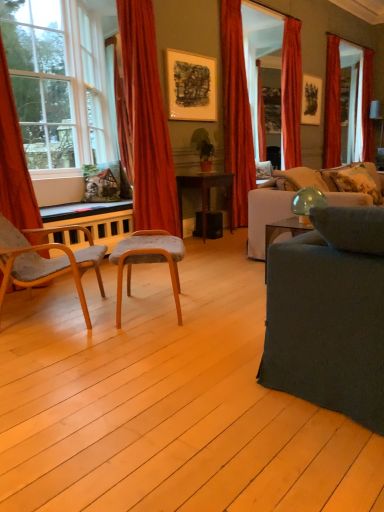
Question: Considering the relative sizes of beige fabric pillow at right, the first pillow when ordered from left to right, and red velvet curtain at upper right, marked as the first curtain in a back-to-front arrangement, in the image provided, is beige fabric pillow at right, the first pillow when ordered from left to right, bigger than red velvet curtain at upper right, marked as the first curtain in a back-to-front arrangement,?

Choices:
 (A) yes
 (B) no

Answer: (B)

Question: Considering the relative sizes of beige fabric pillow at right, the first pillow when ordered from left to right, and red velvet curtain at upper right, which is the 5th curtain in left-to-right order, in the image provided, is beige fabric pillow at right, the first pillow when ordered from left to right, taller than red velvet curtain at upper right, which is the 5th curtain in left-to-right order,?

Choices:
 (A) no
 (B) yes

Answer: (A)

Question: From a real-world perspective, is beige fabric pillow at right, acting as the 2th pillow starting from the right, over red velvet curtain at upper right, which is the 5th curtain in left-to-right order?

Choices:
 (A) no
 (B) yes

Answer: (A)

Question: From the image's perspective, does beige fabric pillow at right, acting as the 2th pillow starting from the right, appear higher than red velvet curtain at upper right, marked as the 5th curtain in a front-to-back arrangement?

Choices:
 (A) no
 (B) yes

Answer: (A)

Question: Is beige fabric pillow at right, the first pillow when ordered from left to right, facing towards red velvet curtain at upper right, which is the 5th curtain in left-to-right order?

Choices:
 (A) no
 (B) yes

Answer: (A)

Question: Is beige fabric pillow at right, acting as the 2th pillow starting from the right, to the left of red velvet curtain at upper right, marked as the first curtain in a back-to-front arrangement, from the viewer's perspective?

Choices:
 (A) yes
 (B) no

Answer: (A)

Question: Is velvet red curtain at center, positioned as the 3th curtain in front-to-back order, located within red velvet curtain at upper right, marked as the 5th curtain in a front-to-back arrangement?

Choices:
 (A) yes
 (B) no

Answer: (B)

Question: Can you confirm if red velvet curtain at upper right, the first curtain viewed from the right, is smaller than velvet red curtain at center, positioned as the 3th curtain in front-to-back order?

Choices:
 (A) yes
 (B) no

Answer: (A)

Question: Are red velvet curtain at upper right, which is the 5th curtain in left-to-right order, and velvet red curtain at center, positioned as the 3th curtain in front-to-back order, located far from each other?

Choices:
 (A) yes
 (B) no

Answer: (A)

Question: Considering the relative sizes of red velvet curtain at upper right, marked as the first curtain in a back-to-front arrangement, and velvet red curtain at center, the 3th curtain in the back-to-front sequence, in the image provided, is red velvet curtain at upper right, marked as the first curtain in a back-to-front arrangement, bigger than velvet red curtain at center, the 3th curtain in the back-to-front sequence,?

Choices:
 (A) no
 (B) yes

Answer: (A)

Question: From the image's perspective, is red velvet curtain at upper right, which is the 5th curtain in left-to-right order, above velvet red curtain at center, the 3th curtain in the back-to-front sequence?

Choices:
 (A) yes
 (B) no

Answer: (A)

Question: Considering the relative sizes of red velvet curtain at upper right, the first curtain viewed from the right, and velvet red curtain at center, the third curtain viewed from the left, in the image provided, is red velvet curtain at upper right, the first curtain viewed from the right, shorter than velvet red curtain at center, the third curtain viewed from the left,?

Choices:
 (A) no
 (B) yes

Answer: (B)

Question: Considering the relative sizes of dark gray fabric couch at right, which ranks as the second studio couch in back-to-front order, and green matte houseplant at center in the image provided, is dark gray fabric couch at right, which ranks as the second studio couch in back-to-front order, taller than green matte houseplant at center?

Choices:
 (A) no
 (B) yes

Answer: (B)